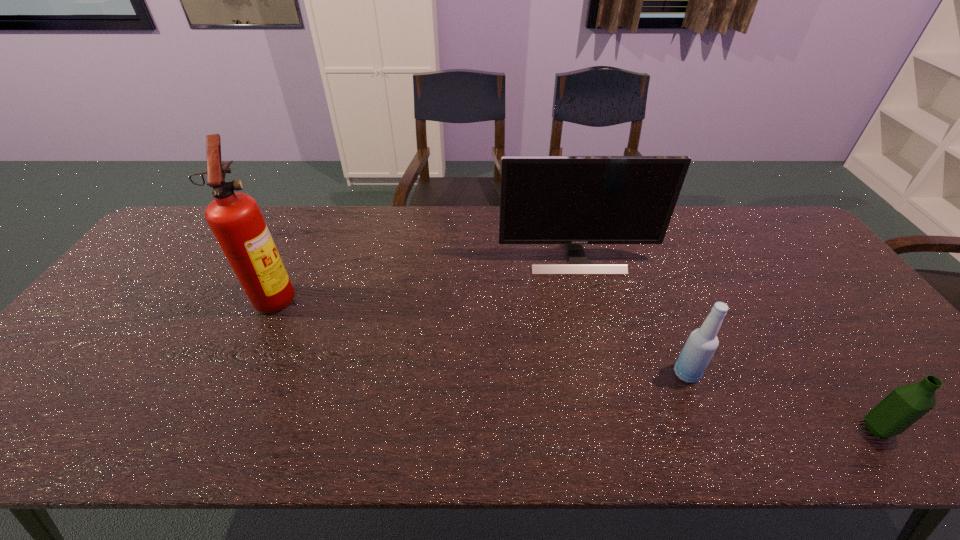
The image size is (960, 540). In order to click on free space located 0.130m on the front of the bottle in this screenshot , I will do `click(712, 438)`.

You are a GUI agent. You are given a task and a screenshot of the screen. Output one action in this format:
    pyautogui.click(x=<x>, y=<y>)
    Task: Click on the vacant space located on the left of the shortest object
    This screenshot has height=540, width=960.
    Given the screenshot: What is the action you would take?
    pyautogui.click(x=761, y=429)

What are the coordinates of `object positioned at the far edge` in the screenshot? It's located at (573, 200).

Locate an element on the screen. Image resolution: width=960 pixels, height=540 pixels. object that is at the near edge is located at coordinates (905, 405).

I want to click on object located at the right edge, so click(905, 405).

Locate an element on the screen. object situated at the near right corner is located at coordinates (905, 405).

This screenshot has height=540, width=960. Identify the location of blank space at the far edge of the desktop. pyautogui.click(x=455, y=249).

This screenshot has height=540, width=960. In the image, there is a desktop. In order to click on vacant space at the near edge in this screenshot , I will do `click(400, 414)`.

In order to click on free region at the right edge in this screenshot , I will do `click(787, 260)`.

In the image, there is a desktop. At what (x,y) coordinates should I click in order to perform the action: click on vacant space at the far left corner. Please return your answer as a coordinate pair (x, y). The width and height of the screenshot is (960, 540). Looking at the image, I should click on (189, 247).